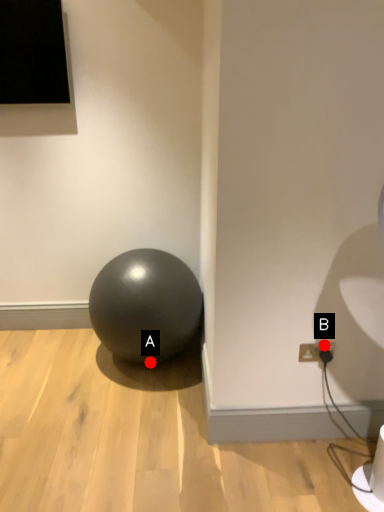
Question: Two points are circled on the image, labeled by A and B beside each circle. Which point is further to the camera?

Choices:
 (A) A is further
 (B) B is further

Answer: (A)